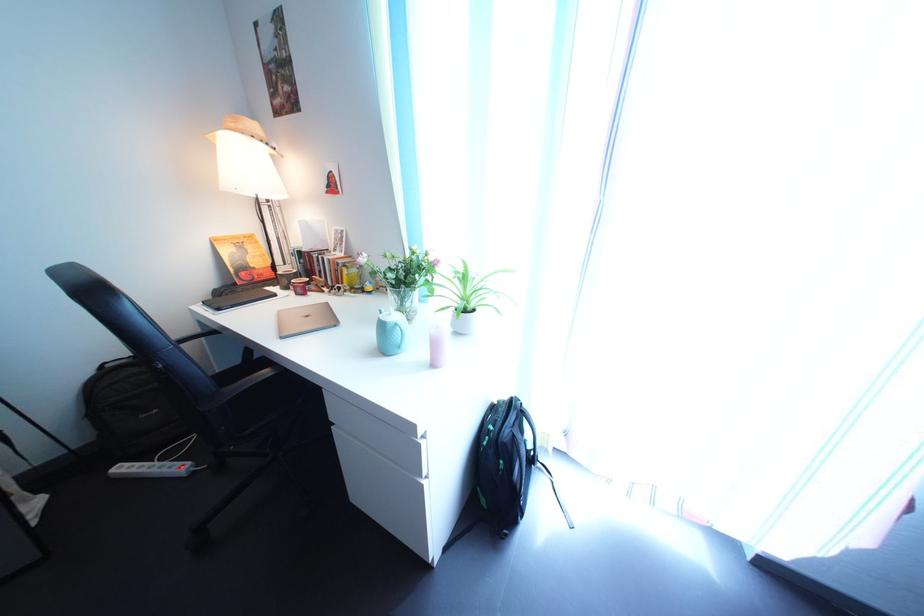
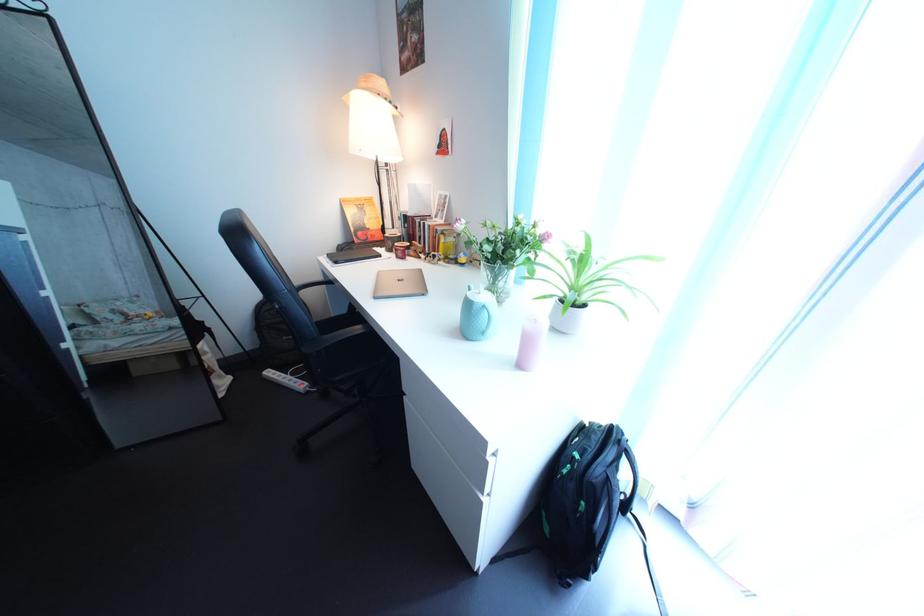
Find the pixel in the second image that matches [247,132] in the first image.

(378, 92)